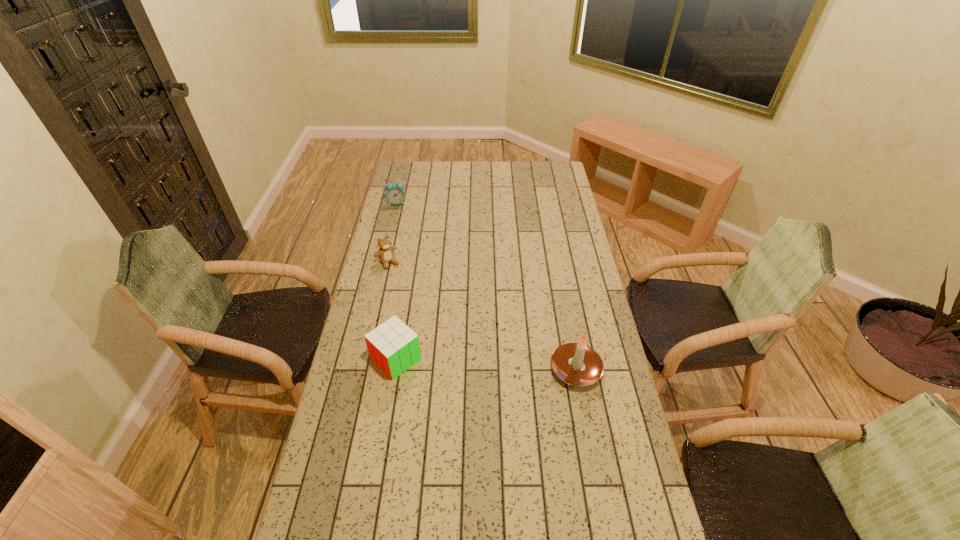
The height and width of the screenshot is (540, 960). Identify the location of vacant space at the right edge of the desktop. (589, 471).

Locate an element on the screen. blank space at the far right corner of the desktop is located at coordinates (545, 182).

I want to click on vacant area between the cube and the candle, so click(486, 364).

Find the location of a particular element. The height and width of the screenshot is (540, 960). vacant area between the farthest object and the teddy bear is located at coordinates (393, 233).

Identify the location of free spot between the rightmost object and the second farthest object. This screenshot has height=540, width=960. (482, 316).

Where is `free point between the cube and the alarm clock`? The width and height of the screenshot is (960, 540). free point between the cube and the alarm clock is located at coordinates (396, 281).

The width and height of the screenshot is (960, 540). Identify the location of free space between the cube and the alarm clock. (396, 281).

Find the location of a particular element. This screenshot has height=540, width=960. vacant space that is in between the rightmost object and the cube is located at coordinates (486, 364).

The image size is (960, 540). I want to click on empty location between the farthest object and the teddy bear, so click(x=393, y=233).

Locate an element on the screen. This screenshot has width=960, height=540. empty space between the farthest object and the third nearest object is located at coordinates (393, 233).